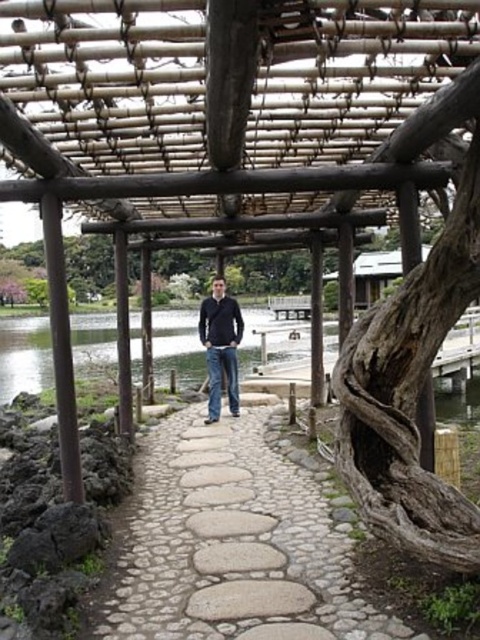
You are a photographer planning to capture the scene with the clear water at center and the dark blue jeans at center. Which object should you focus on first if you want to highlight the larger one in your photo?

The dark blue jeans at center is larger than the clear water at center, so you should focus on the dark blue jeans at center first to highlight the larger object.

You are standing at the camera position and want to know how far the point at coordinates (242, 456) is from you. Can you determine the distance?

The point at coordinates (242, 456) is 19.99 feet away from the camera position.

You are planning to walk along the natural stone pathway at center and the clear water at center in the scene. Which path is wider?

The natural stone pathway at center is wider than the clear water at center because its width surpasses the clear water at center.